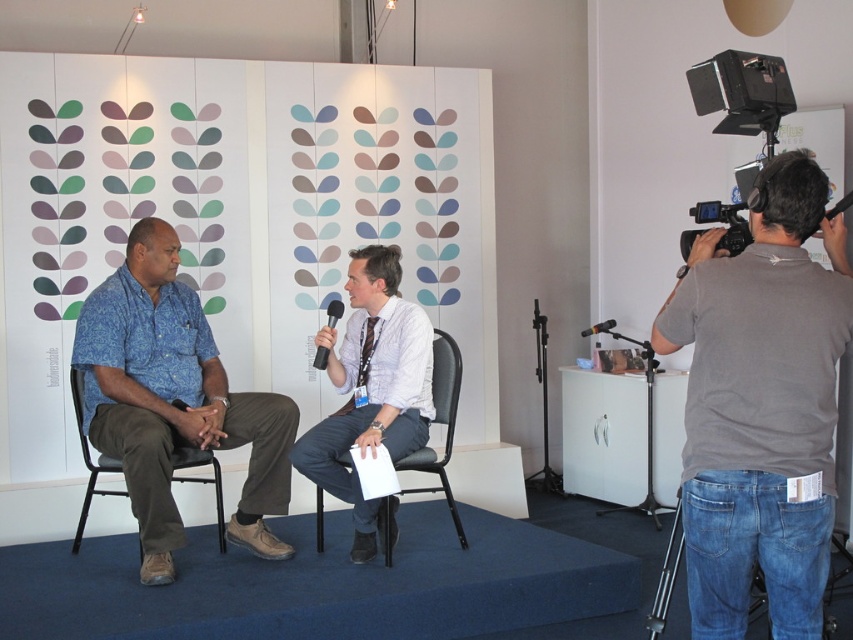
Question: Can you confirm if black matte microphone at center is bigger than black matte microphone at upper right?

Choices:
 (A) yes
 (B) no

Answer: (B)

Question: Which object is closer to the camera taking this photo?

Choices:
 (A) metallic black chair at left
 (B) black plastic video camera at upper right

Answer: (B)

Question: Based on their relative distances, which object is nearer to the blue printed shirt at left?

Choices:
 (A) black matte microphone at center
 (B) metallic black chair at left
 (C) gray cotton shirt at right
 (D) black plastic chair at center

Answer: (B)

Question: Considering the real-world distances, which object is farthest from the metallic black chair at left?

Choices:
 (A) black matte microphone at upper right
 (B) black matte microphone at center
 (C) gray cotton shirt at right
 (D) black plastic chair at center

Answer: (A)

Question: From the image, what is the correct spatial relationship of gray cotton shirt at right in relation to black matte microphone at upper right?

Choices:
 (A) below
 (B) above

Answer: (A)

Question: Can you confirm if blue printed shirt at left is wider than black plastic video camera at upper right?

Choices:
 (A) yes
 (B) no

Answer: (A)